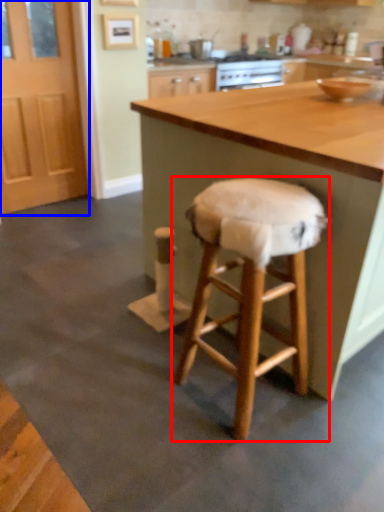
Question: Which object is closer to the camera taking this photo, stool (highlighted by a red box) or screen door (highlighted by a blue box)?

Choices:
 (A) stool
 (B) screen door

Answer: (A)